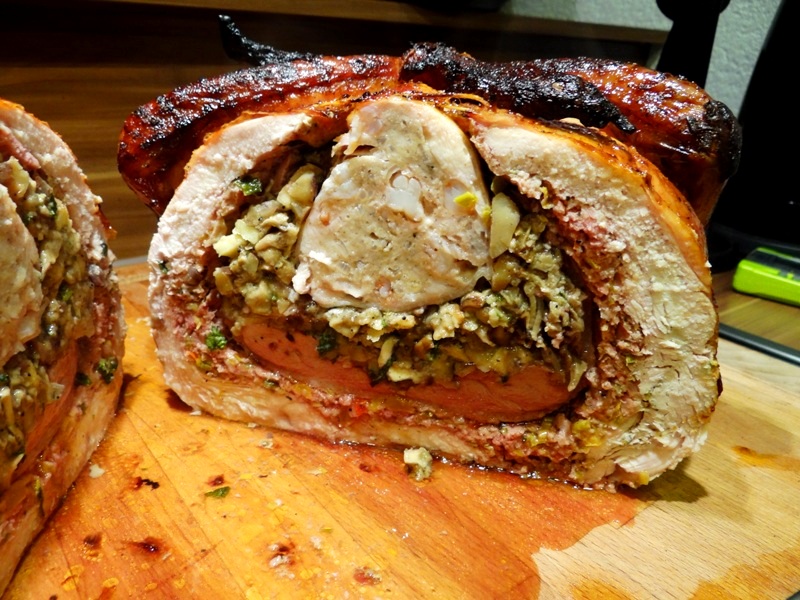
The height and width of the screenshot is (600, 800). I want to click on wooden surface, so click(669, 539).